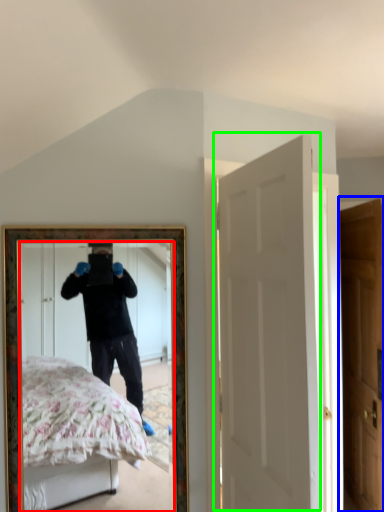
Question: Considering the real-world distances, which object is farthest from mirror (highlighted by a red box)? door (highlighted by a blue box) or door (highlighted by a green box)?

Choices:
 (A) door
 (B) door

Answer: (B)